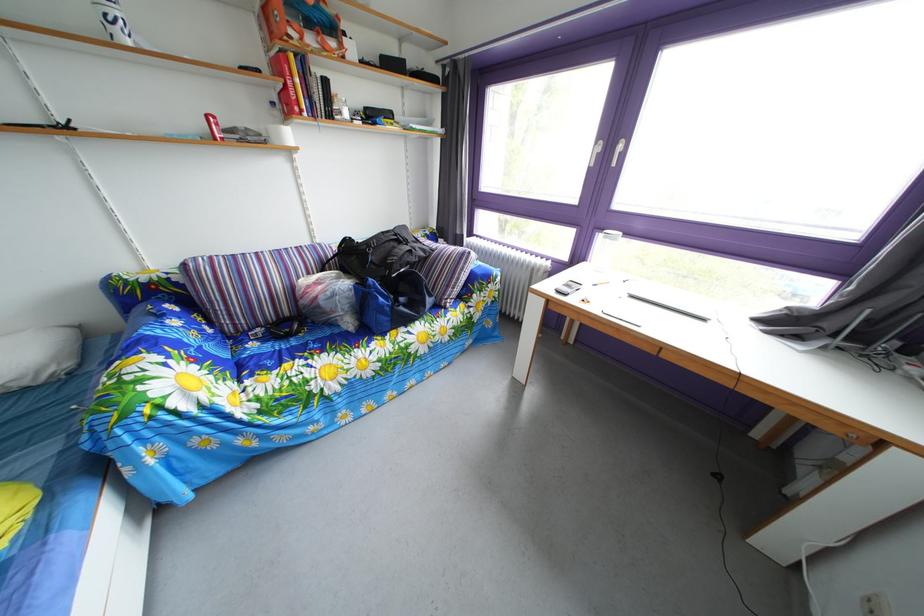
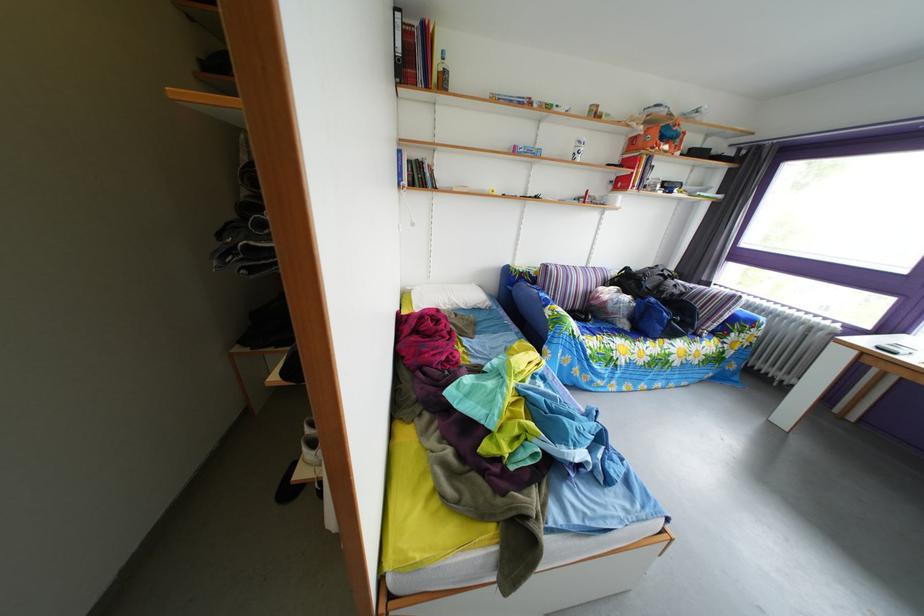
In the second image, find the point that corresponds to the point at 157,308 in the first image.

(529, 289)